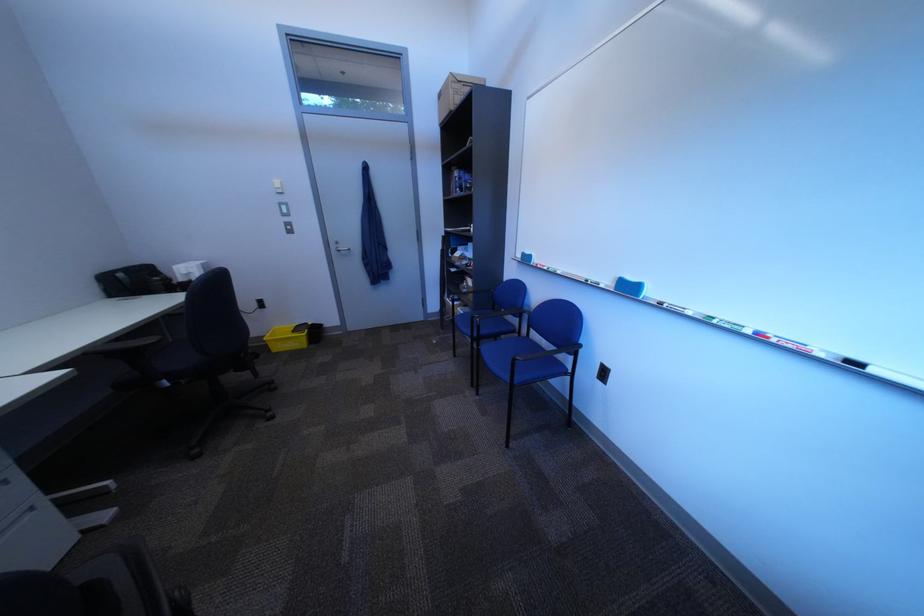
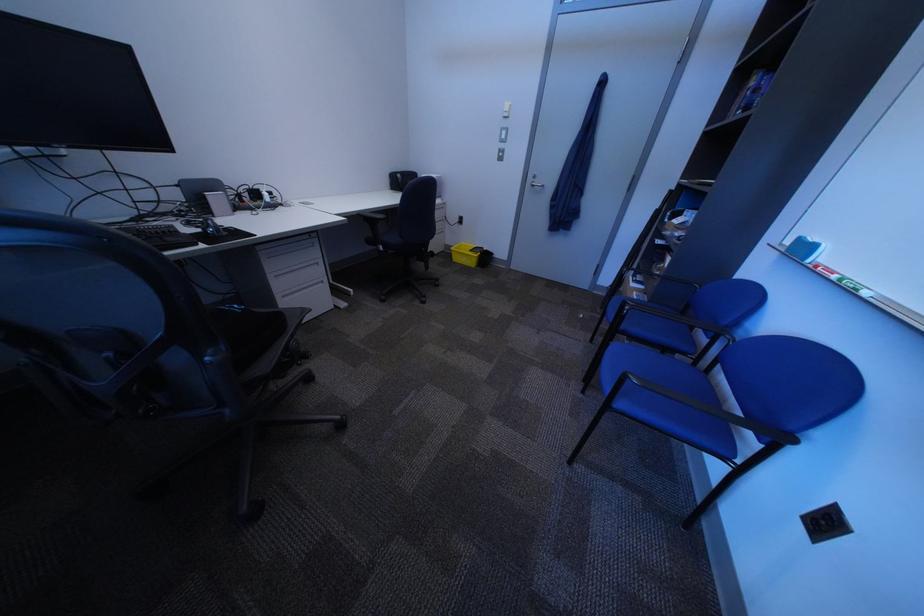
In the second image, find the point that corresponds to the point at 452,344 in the first image.

(599, 318)